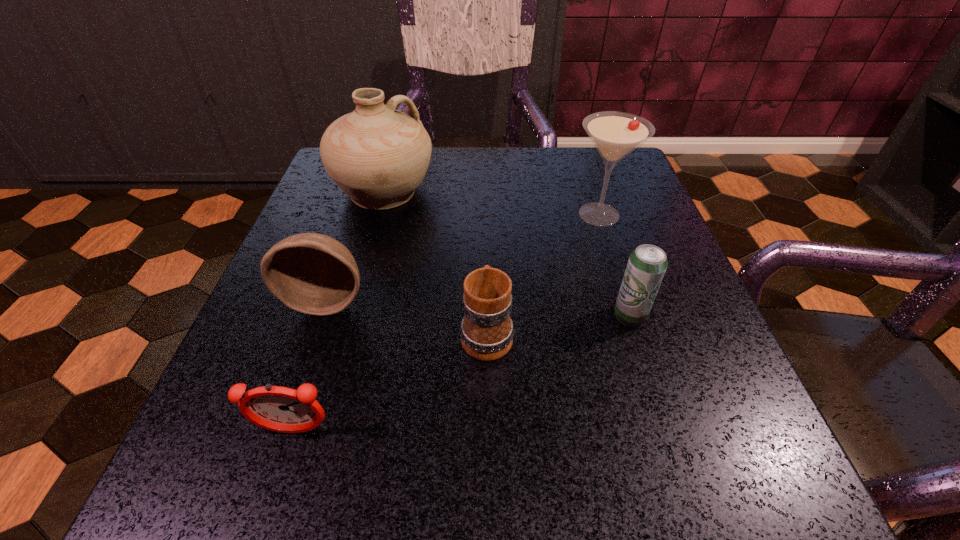
You are a GUI agent. You are given a task and a screenshot of the screen. Output one action in this format:
    pyautogui.click(x=<x>, y=<y>)
    Task: Click on the blank space located on the back of the beer can
    The height and width of the screenshot is (540, 960).
    Given the screenshot: What is the action you would take?
    pyautogui.click(x=607, y=245)

What are the coordinates of `vacant area located on the side of the mug with the handle` in the screenshot? It's located at (486, 264).

This screenshot has width=960, height=540. Identify the location of vacant position located 0.290m on the side of the mug with the handle. (485, 204).

Identify the location of free space located 0.380m on the side of the mug with the handle. tap(485, 180).

Where is `free space located 0.060m on the front-facing side of the nearest object`? The height and width of the screenshot is (540, 960). free space located 0.060m on the front-facing side of the nearest object is located at coordinates (276, 489).

Find the location of `pottery that is at the far edge`. pottery that is at the far edge is located at coordinates (378, 156).

This screenshot has height=540, width=960. Identify the location of martini that is at the far edge. (615, 134).

This screenshot has height=540, width=960. Identify the location of object positioned at the near edge. (281, 409).

This screenshot has height=540, width=960. In order to click on pottery at the left edge in this screenshot , I will do `click(378, 156)`.

Where is `bowl located in the left edge section of the desktop`? bowl located in the left edge section of the desktop is located at coordinates (311, 273).